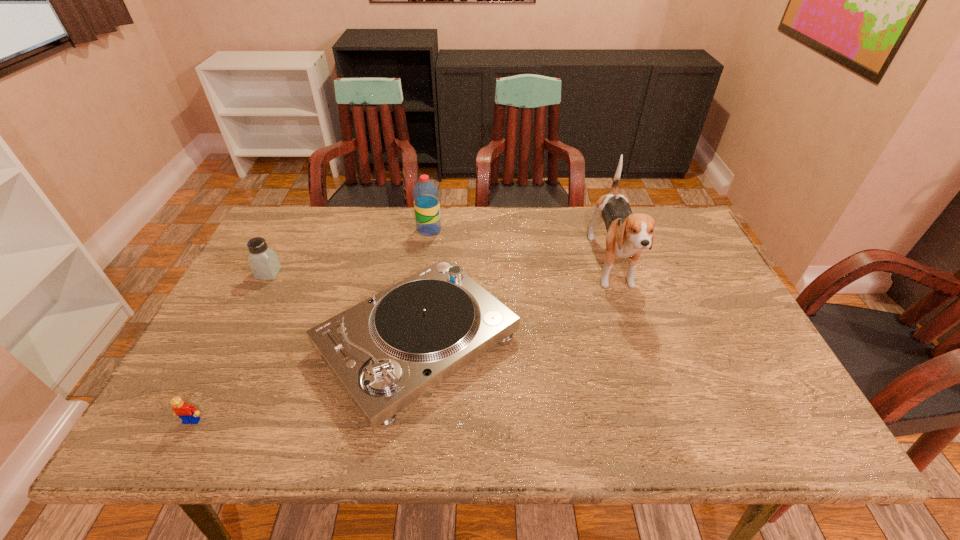
Identify the location of the rightmost object. This screenshot has width=960, height=540. (627, 234).

The width and height of the screenshot is (960, 540). What are the coordinates of `puppy` in the screenshot? It's located at (627, 234).

Find the location of `water bottle`. water bottle is located at coordinates (425, 193).

Where is `saltshaker`? The height and width of the screenshot is (540, 960). saltshaker is located at coordinates (263, 261).

Locate an element on the screen. Image resolution: width=960 pixels, height=540 pixels. record player is located at coordinates (387, 351).

Find the location of a particular element. Lego is located at coordinates (188, 414).

Where is `free region located at the face of the puppy`? free region located at the face of the puppy is located at coordinates (669, 442).

I want to click on free location located on the front label of the water bottle, so click(463, 230).

The height and width of the screenshot is (540, 960). Identify the location of vacant area situated 0.150m on the front of the saltshaker. (245, 320).

The image size is (960, 540). In order to click on free space located 0.300m on the back of the record player in this screenshot , I will do `click(434, 214)`.